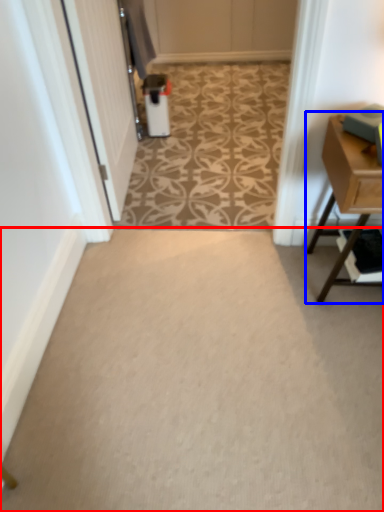
Question: Which object appears farthest to the camera in this image, plain (highlighted by a red box) or table (highlighted by a blue box)?

Choices:
 (A) plain
 (B) table

Answer: (B)